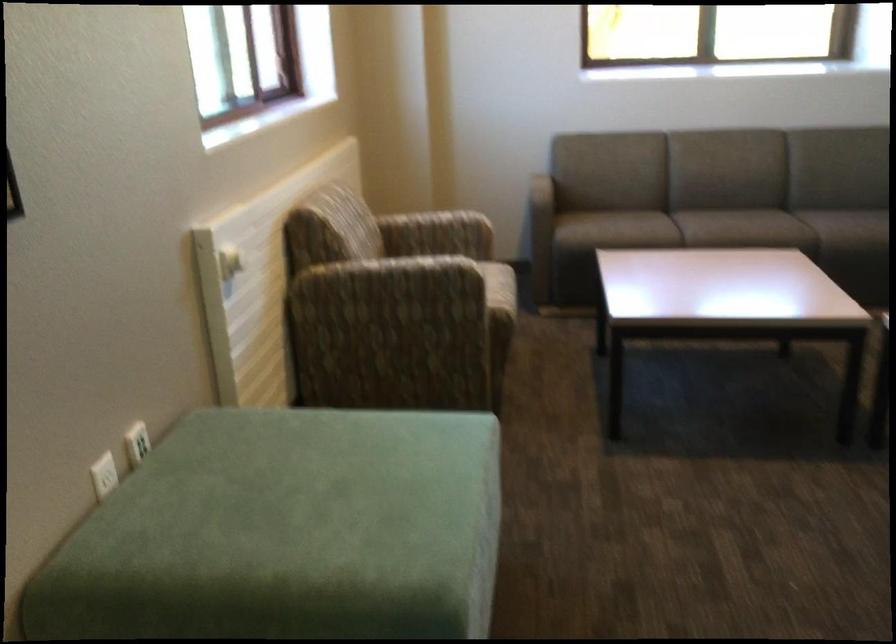
Describe the element at coordinates (780, 229) in the screenshot. I see `a grey sofa sitting surface` at that location.